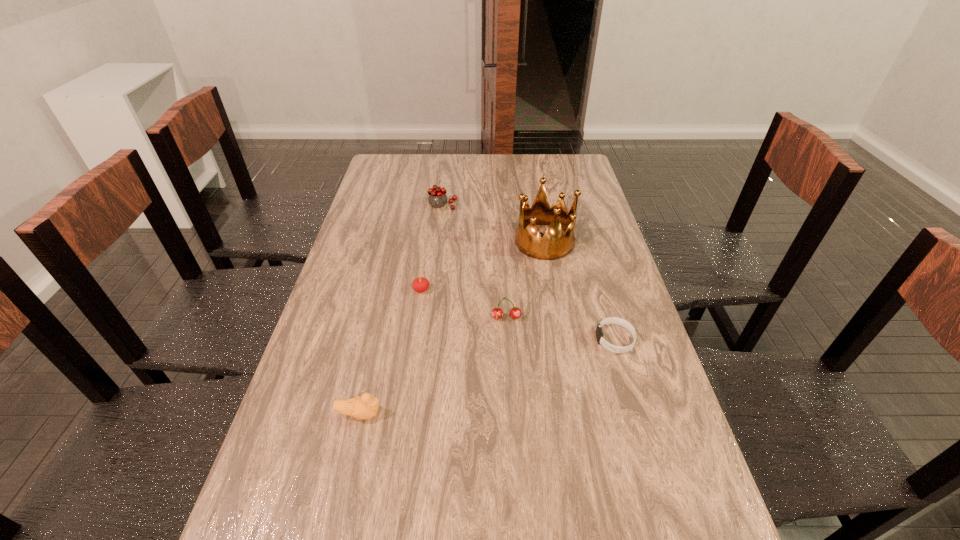
Locate an element on the screen. The image size is (960, 540). wristband is located at coordinates (610, 320).

Identify the location of vacant space located 0.200m on the back of the second farthest object. (536, 193).

Identify the location of blank area located 0.160m on the handle side of the tallest cherry. (439, 241).

This screenshot has height=540, width=960. What are the coordinates of `blank area located on the back of the fourth nearest object` in the screenshot? It's located at (426, 256).

You are a GUI agent. You are given a task and a screenshot of the screen. Output one action in this format:
    pyautogui.click(x=<x>, y=<y>)
    Task: Click on the free spot located with stems pointing upwards on the rightmost cherry
    The image size is (960, 540).
    Given the screenshot: What is the action you would take?
    (x=508, y=343)

You are a GUI agent. You are given a task and a screenshot of the screen. Output one action in this format:
    pyautogui.click(x=<x>, y=<y>)
    Task: Click on the vacant space situated 0.190m on the face of the leftmost object
    The image size is (960, 540).
    Given the screenshot: What is the action you would take?
    pyautogui.click(x=468, y=414)

I want to click on vacant area situated 0.190m on the outer surface of the shortest object, so click(522, 339).

Locate an element on the screen. vacant area situated on the outer surface of the shortest object is located at coordinates (558, 339).

This screenshot has height=540, width=960. What are the coordinates of `free space located 0.310m on the outer surface of the shortest object` in the screenshot? It's located at (475, 339).

The image size is (960, 540). I want to click on object positioned at the left edge, so click(x=365, y=407).